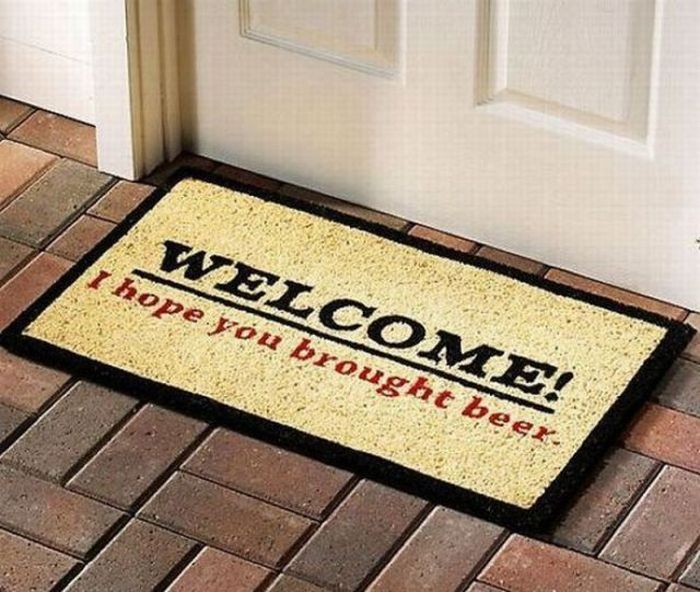
The height and width of the screenshot is (592, 700). In order to click on door frame in this screenshot , I will do `click(145, 126)`.